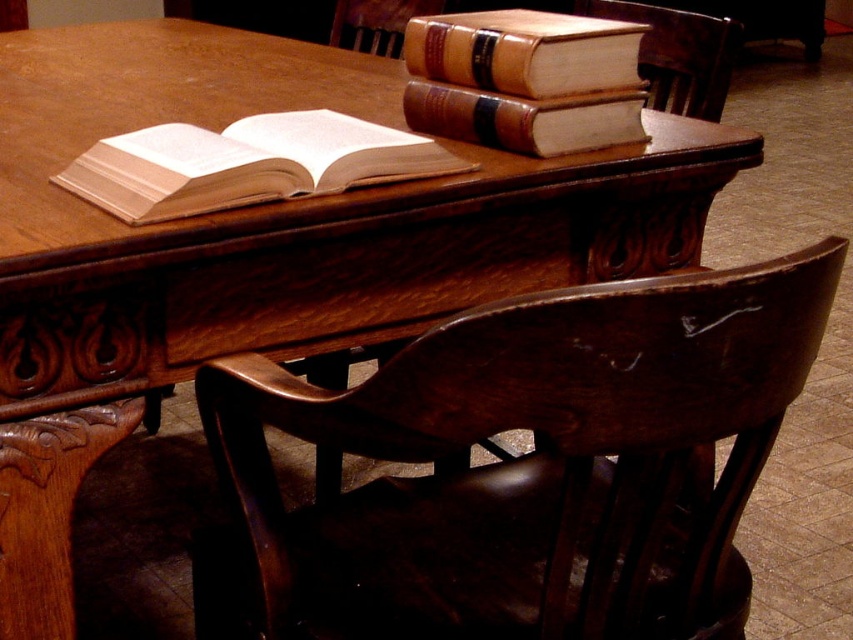
Question: Which of the following is the closest to the observer?

Choices:
 (A) dark brown wood chair at upper right
 (B) wooden chair at center
 (C) light beige paper book at center

Answer: (C)

Question: Based on their relative distances, which object is nearer to the brown leather book at upper center?

Choices:
 (A) wooden chair at center
 (B) brown leather book at upper right
 (C) light beige paper book at center
 (D) dark brown wood chair at upper right

Answer: (B)

Question: Which object is closer to the camera taking this photo?

Choices:
 (A) light beige paper book at center
 (B) brown leather book at upper right
 (C) dark wood chair at center
 (D) brown leather book at upper center

Answer: (C)

Question: Is brown leather book at upper right wider than wooden chair at center?

Choices:
 (A) no
 (B) yes

Answer: (B)

Question: Does light beige paper book at center appear on the right side of brown leather book at upper center?

Choices:
 (A) yes
 (B) no

Answer: (B)

Question: Where is light beige paper book at center located in relation to brown leather book at upper center in the image?

Choices:
 (A) left
 (B) right

Answer: (A)